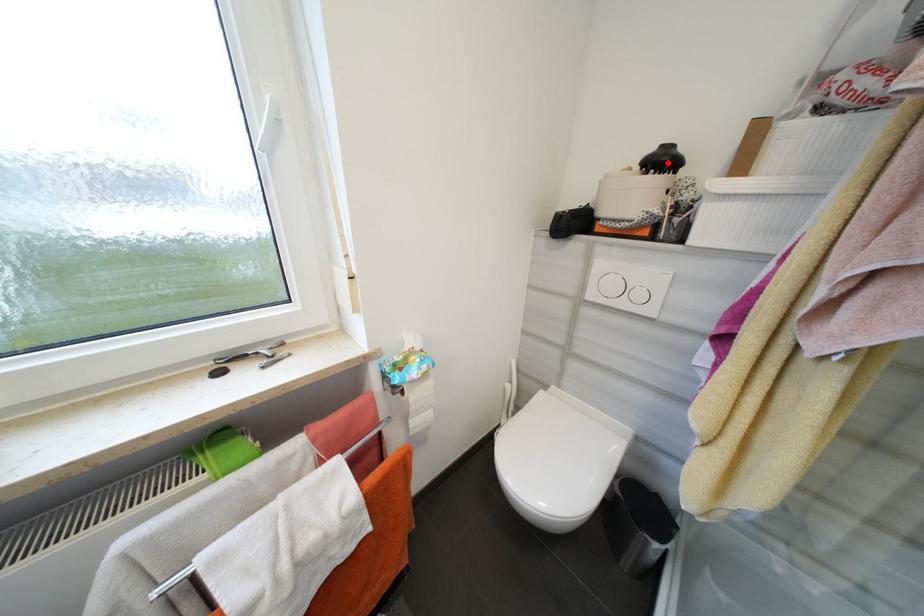
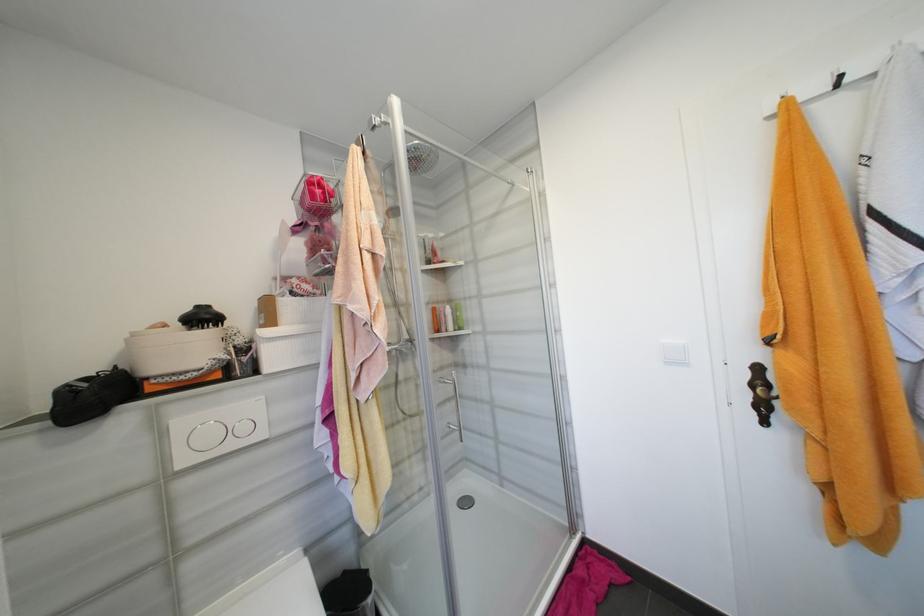
The point at the highlighted location is marked in the first image. Where is the corresponding point in the second image?

(210, 318)